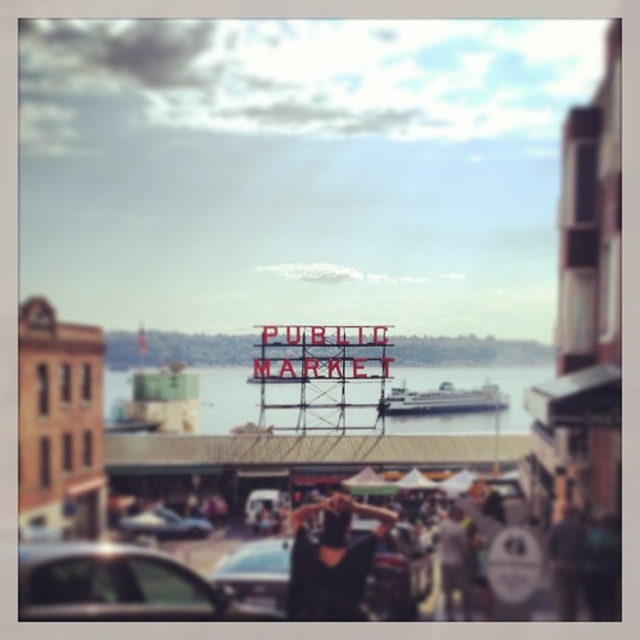
Question: Which of these objects is positioned closest to the metallic water at center?

Choices:
 (A) metallic silver car at center
 (B) black satin dress at center
 (C) red painted metal sign at center
 (D) metallic silver car at lower center

Answer: (C)

Question: Does red painted metal sign at center have a smaller size compared to metallic silver car at lower center?

Choices:
 (A) yes
 (B) no

Answer: (B)

Question: From the image, what is the correct spatial relationship of metallic silver car at center in relation to metallic silver car at lower center?

Choices:
 (A) right
 (B) left

Answer: (A)

Question: Which point is closer to the camera?

Choices:
 (A) (204, 371)
 (B) (244, 582)
 (C) (344, 387)
 (D) (125, 584)

Answer: (B)

Question: Which point appears closest to the camera in this image?

Choices:
 (A) (330, 570)
 (B) (45, 561)

Answer: (A)

Question: Does red painted metal sign at center have a larger size compared to metallic silver car at lower center?

Choices:
 (A) no
 (B) yes

Answer: (B)